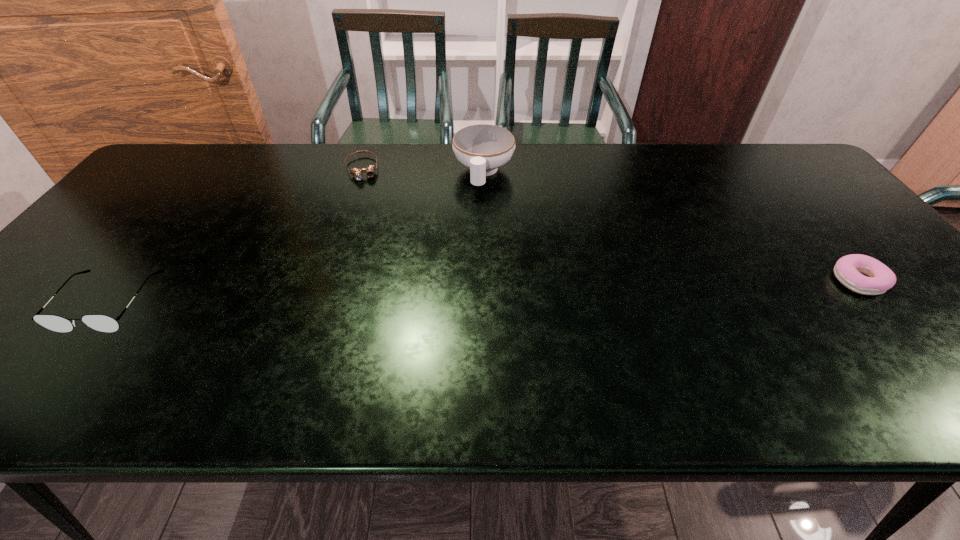
The image size is (960, 540). What are the coordinates of `free space between the third object from left to right and the shortest object` in the screenshot? It's located at point(422,171).

This screenshot has height=540, width=960. I want to click on vacant area between the third tallest object and the spectacles, so pyautogui.click(x=484, y=292).

The width and height of the screenshot is (960, 540). I want to click on free space between the tallest object and the second tallest object, so click(297, 238).

Find the location of a particular element. The image size is (960, 540). free point between the third object from right to left and the tallest object is located at coordinates (422, 171).

You are a GUI agent. You are given a task and a screenshot of the screen. Output one action in this format:
    pyautogui.click(x=<x>, y=<y>)
    Task: Click on the free space that is in between the third object from left to right and the rightmost object
    This screenshot has width=960, height=540.
    Given the screenshot: What is the action you would take?
    pyautogui.click(x=671, y=227)

Where is `vacant region between the second shortest object and the shortest object`? vacant region between the second shortest object and the shortest object is located at coordinates (610, 225).

Find the location of a particular element. This screenshot has width=960, height=540. object that is the third closest one to the chinaware is located at coordinates (848, 269).

Locate an element on the screen. Image resolution: width=960 pixels, height=540 pixels. the third closest object to the second tallest object is located at coordinates (848, 269).